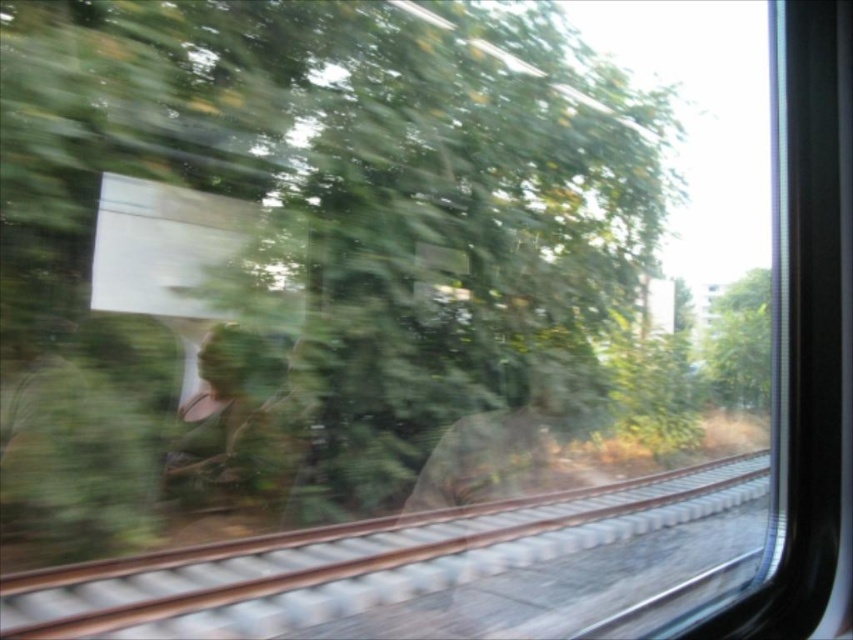
You are a passenger on a train and looking out the window. You see a brown metal track at lower center and a green leafy tree at right. Which object is closer to you?

The brown metal track at lower center is closer to you because it is in front of the green leafy tree at right.

You are a photographer standing inside a moving train and want to capture a clear photo of the brown metal track at lower center. Considering the train is moving at 30 mph, what is the minimum shutter speed needed to avoid motion blur? Assume the recommended shutter speed is 1 over the speed in mph.

The brown metal track at lower center is 11.17 feet away from the camera. To avoid motion blur while moving at 30 mph, the recommended shutter speed is 1 divided by 30, which is approximately 1.3 seconds. However, this calculation assumes a static subject and may not account for the train movement speed relative to the track distance. A faster shutter speed like 1.3 seconds might still result in blur due to the train speed. A better approach would be to use a shutter speed of 1 over the speed in mph, so 1.3